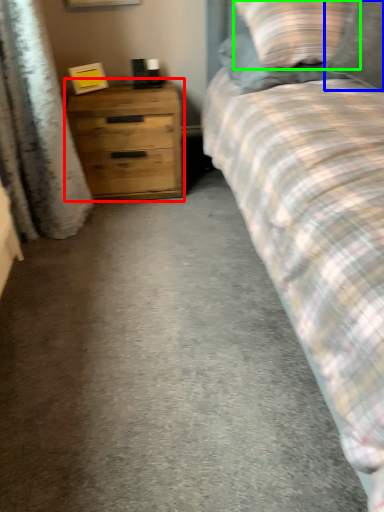
Question: Based on their relative distances, which object is nearer to chest of drawers (highlighted by a red box)? Choose from pillow (highlighted by a blue box) and pillow (highlighted by a green box).

Choices:
 (A) pillow
 (B) pillow

Answer: (B)